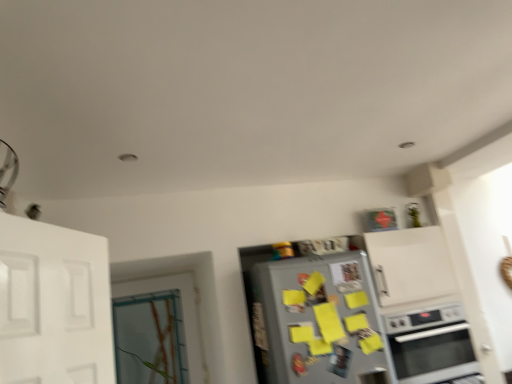
Question: From a real-world perspective, is satin silver oven at lower right physically located above or below clear glass door at left?

Choices:
 (A) above
 (B) below

Answer: (B)

Question: From the image's perspective, is satin silver oven at lower right above or below clear glass door at left?

Choices:
 (A) below
 (B) above

Answer: (A)

Question: Estimate the real-world distances between objects in this image. Which object is farther from the silver metallic refrigerator at center?

Choices:
 (A) clear glass door at left
 (B) satin silver oven at lower right

Answer: (A)

Question: Which is nearer to the clear glass door at left?

Choices:
 (A) satin silver oven at lower right
 (B) silver metallic refrigerator at center

Answer: (B)